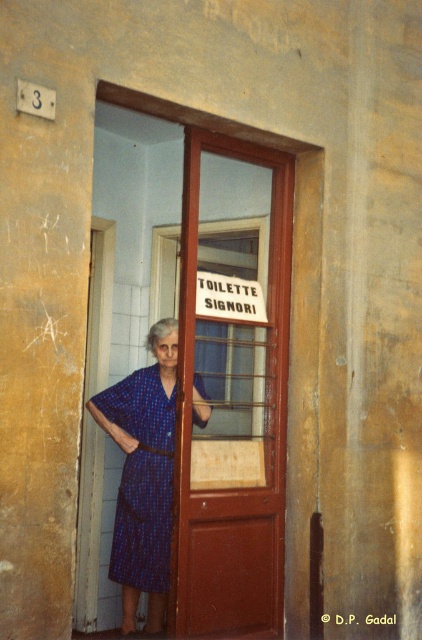
You are a delivery person trying to locate the men restroom in this building. You see the brown wooden door at center. Based on its position, can you determine if it is the correct door to enter?

The brown wooden door at center has a sign that reads TOILETTE SIGNORI, which indicates it is the men restroom, so yes, it is the correct door to enter.

You are a delivery person carrying a box that is 3 feet wide. You need to pass through the brown wooden door at center while avoiding the blue printed dress at center. Is there enough space between them to move through?

The brown wooden door at center is 32.02 inches away from the blue printed dress at center. Since 32.02 inches is approximately 2.67 feet, which is less than the 3 feet width of the box, there is not enough space to pass through without touching either the door or the dress.

You are standing at the point labeled point [219,339] and want to enter the building through the doorway. The door is 2 meters wide. Can you walk through the doorway without touching the door frame?

The distance between you and the viewer is 4.27 meters, so you can walk through the doorway without touching the door frame since the door is 2 meters wide and the distance is sufficient.